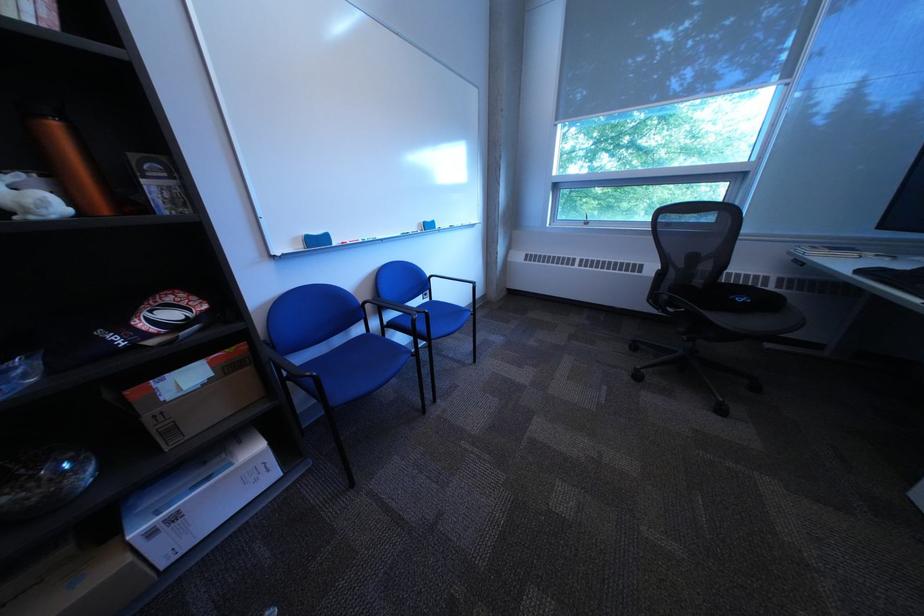
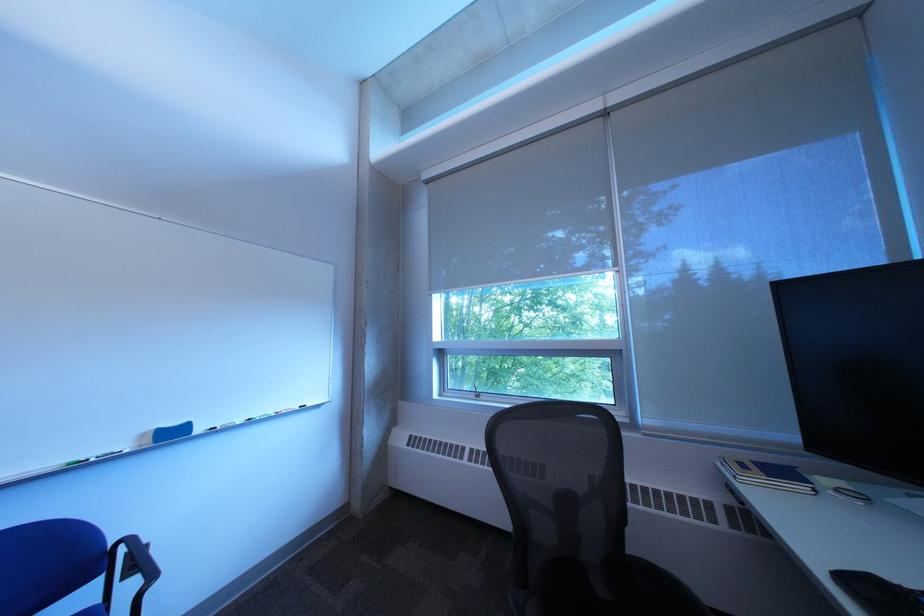
In the second image, find the point that corresponds to point 453,229 in the first image.

(213, 432)